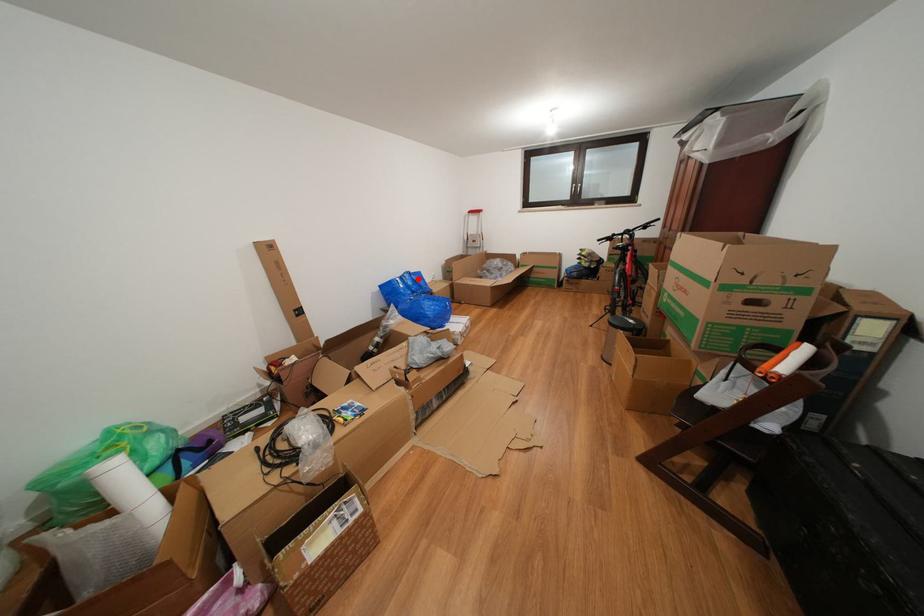
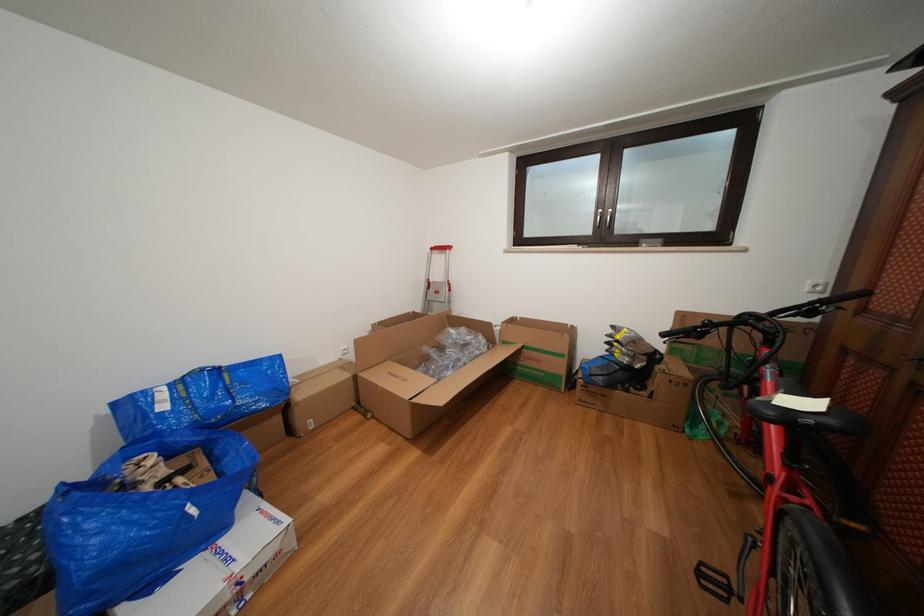
Question: I am providing you with two images of the same scene from different viewpoints. Image1 has a red point marked. In image2, the corresponding 3D location appears at what relative position? Reply with the corresponding letter.

Choices:
 (A) Closer
 (B) Farther

Answer: (B)